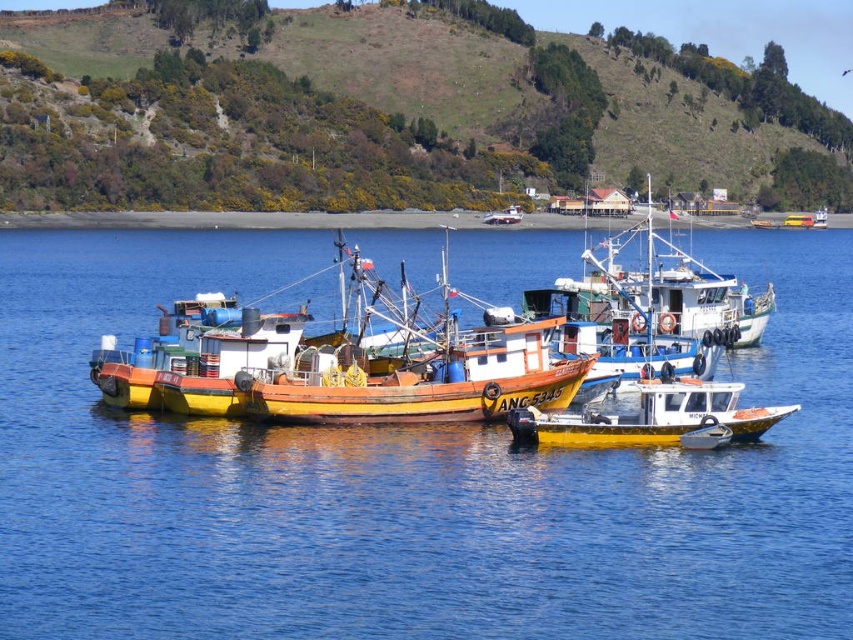
Is blue water at center thinner than green grassy hillside at upper center?

Yes.

This screenshot has height=640, width=853. Describe the element at coordinates (403, 480) in the screenshot. I see `blue water at center` at that location.

Does point (787, 525) come closer to viewer compared to point (778, 58)?

Yes.

This screenshot has height=640, width=853. I want to click on blue water at center, so click(x=403, y=480).

Which is more to the left, green grassy hillside at upper center or yellow matte boat at center?

green grassy hillside at upper center is more to the left.

Is green grassy hillside at upper center taller than yellow matte boat at center?

A: Correct, green grassy hillside at upper center is much taller as yellow matte boat at center.

The width and height of the screenshot is (853, 640). I want to click on green grassy hillside at upper center, so (x=392, y=112).

Find the location of a particular element. green grassy hillside at upper center is located at coordinates (392, 112).

Is blue water at center further to camera compared to yellow matte boat at center?

No, blue water at center is in front of yellow matte boat at center.

Locate an element on the screen. This screenshot has height=640, width=853. blue water at center is located at coordinates (403, 480).